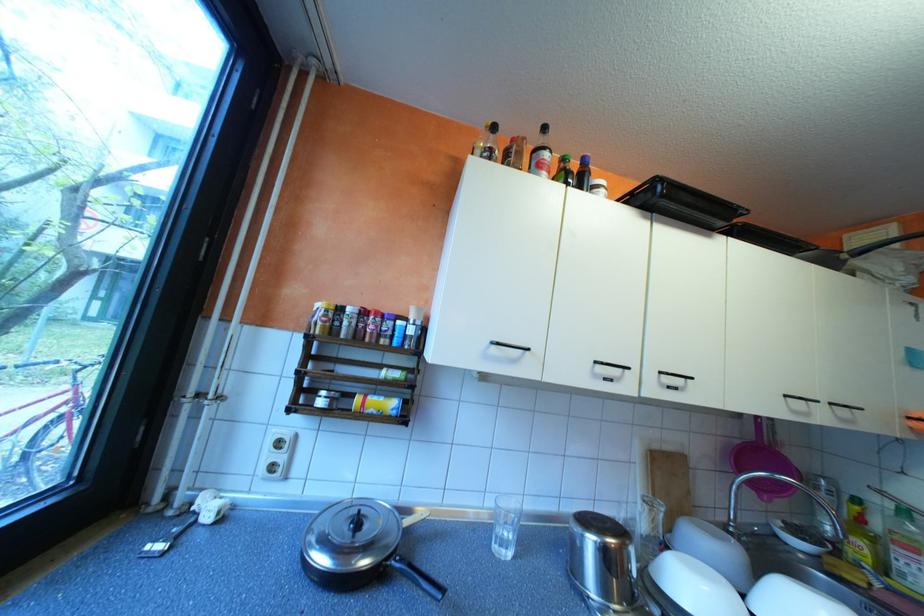
Where would you drink the drinking glass? Please return your answer as a coordinate pair (x, y).

(505, 525)